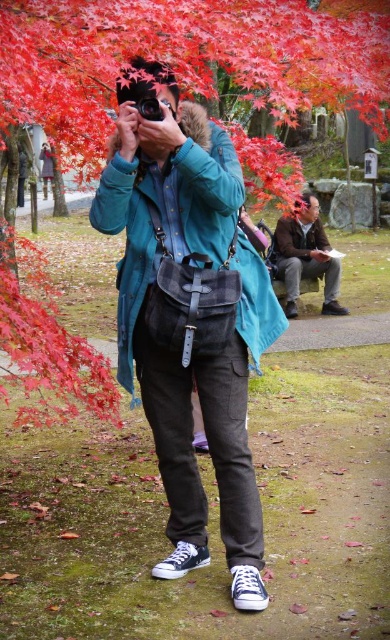
Does shiny red maple leaf at upper left have a lesser width compared to brown leather jacket at lower right?

Yes, shiny red maple leaf at upper left is thinner than brown leather jacket at lower right.

Between shiny red maple leaf at upper left and brown leather jacket at lower right, which one appears on the right side from the viewer's perspective?

brown leather jacket at lower right

What are the coordinates of `shiny red maple leaf at upper left` in the screenshot? It's located at (47, 342).

Between matte black camera at center and black leather camera at center, which one is positioned higher?

Positioned higher is black leather camera at center.

Describe the element at coordinates (189, 316) in the screenshot. I see `matte black camera at center` at that location.

Is point (246, 257) farther from viewer compared to point (138, 104)?

Yes.

Identify the location of matte black camera at center. (189, 316).

Is matte black camera at center above brown leather jacket at lower right?

No, matte black camera at center is not above brown leather jacket at lower right.

This screenshot has width=390, height=640. In order to click on matte black camera at center in this screenshot , I will do `click(189, 316)`.